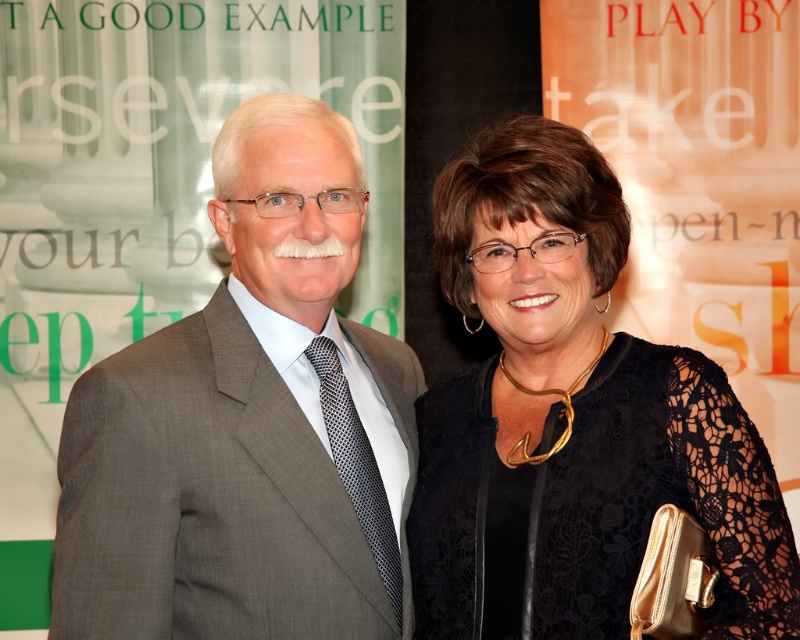
You are a photographer adjusting the focus of your camera. You want to ensure that both points, point 1 at point 1 at point (336, 508) and point 2 at point (564, 616), are in focus. Which point should you focus on first to achieve this?

You should focus on point (336, 508) first because it is closer to the viewer than point (564, 616). This ensures that the focus can extend to the farther point as well.

You are organizing a charity event and need to determine which outfit takes up more space. Given the image, which of the two outfits, the gray suit at center or the black lace dress at center, is larger in size?

The gray suit at center is bigger than the black lace dress at center, so the gray suit at center takes up more space.

You are a photographer adjusting the camera settings for a group photo. You notice the gray suit at center and the black lace dress at center. Which clothing item is narrower in width?

The gray suit at center is narrower in width than the black lace dress at center.